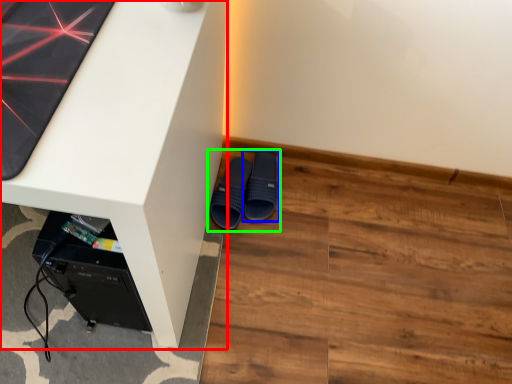
Question: Which object is the closest to the desk (highlighted by a red box)? Choose among these: footwear (highlighted by a blue box) or footwear (highlighted by a green box).

Choices:
 (A) footwear
 (B) footwear

Answer: (B)